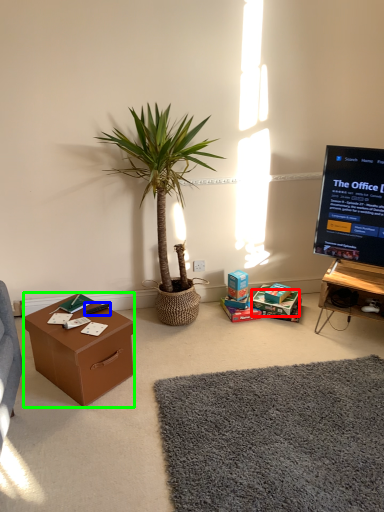
Question: Estimate the real-world distances between objects in this image. Which object is closer to storage box (highlighted by a red box), remote control (highlighted by a blue box) or desk (highlighted by a green box)?

Choices:
 (A) remote control
 (B) desk

Answer: (A)